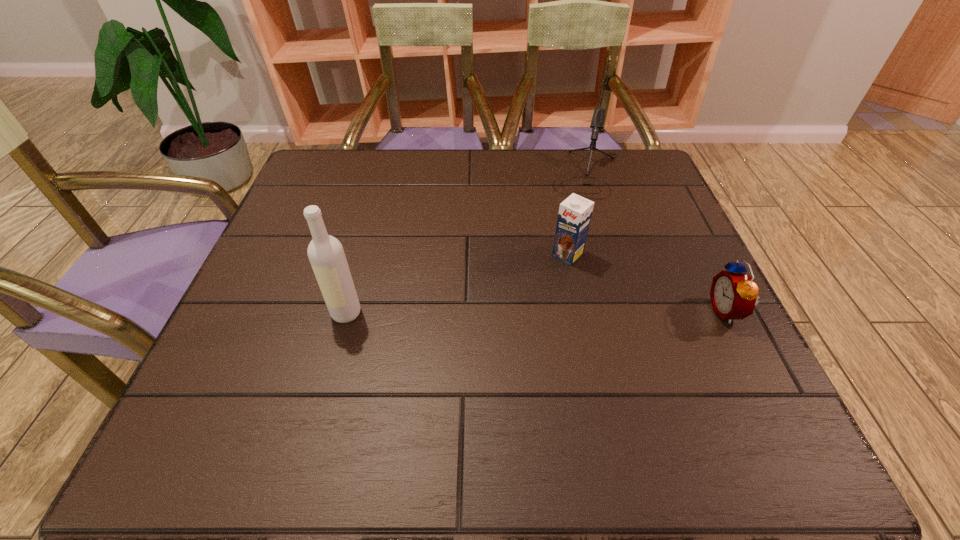
Image resolution: width=960 pixels, height=540 pixels. I want to click on free space on the desktop that is between the leftmost object and the rightmost object and is positioned on the stand of the microphone, so click(x=554, y=312).

Image resolution: width=960 pixels, height=540 pixels. Find the location of `vacant space on the desktop that is between the leftmost object and the alarm clock and is positioned on the front label of the chocolate milk`. vacant space on the desktop that is between the leftmost object and the alarm clock and is positioned on the front label of the chocolate milk is located at coordinates (510, 312).